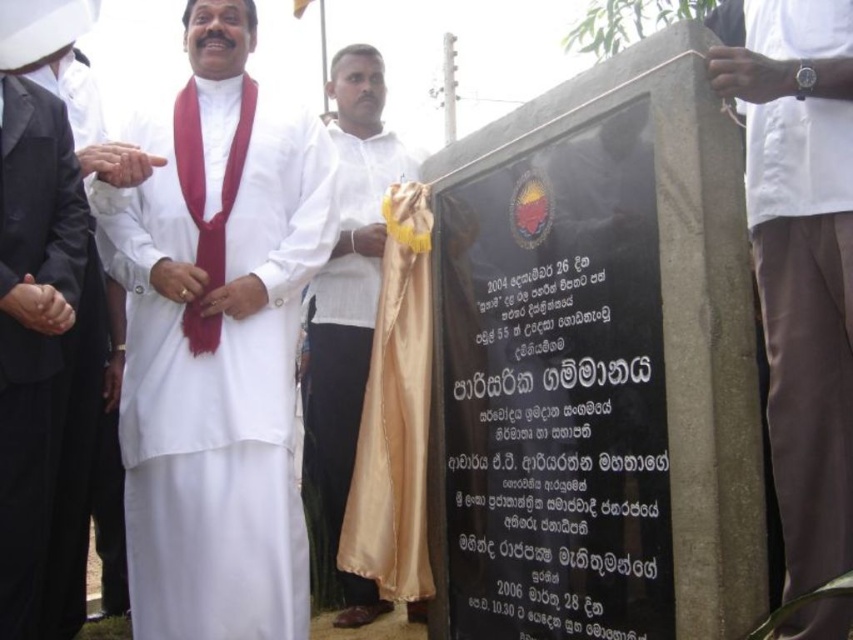
Does white smooth shirt at right have a greater height compared to silky red tie at left?

Yes.

This screenshot has width=853, height=640. Identify the location of white smooth shirt at right. (801, 260).

Where is `white smooth shirt at right`? This screenshot has height=640, width=853. white smooth shirt at right is located at coordinates (801, 260).

Who is higher up, white silk robe at center or silky red tie at left?

silky red tie at left is higher up.

You are a GUI agent. You are given a task and a screenshot of the screen. Output one action in this format:
    pyautogui.click(x=<x>, y=<y>)
    Task: Click on the white silk robe at center
    The image size is (853, 640).
    Given the screenshot: What is the action you would take?
    pyautogui.click(x=218, y=360)

Does point (190, 333) come behind point (190, 202)?

No, (190, 333) is closer to viewer.

The image size is (853, 640). I want to click on white silk robe at center, so click(218, 360).

From the picture: How much distance is there between black satin robe at left and white satin cloth at center?

black satin robe at left and white satin cloth at center are 5.15 meters apart from each other.

From the picture: Is black satin robe at left below white satin cloth at center?

No.

Is point (33, 554) in front of point (343, 232)?

Yes, point (33, 554) is in front of point (343, 232).

Image resolution: width=853 pixels, height=640 pixels. I want to click on black satin robe at left, so click(32, 326).